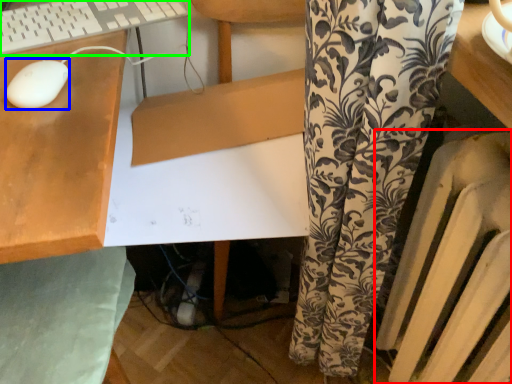
Question: Which object is positioned farthest from radiator (highlighted by a red box)? Select from mouse (highlighted by a blue box) and computer keyboard (highlighted by a green box).

Choices:
 (A) mouse
 (B) computer keyboard

Answer: (B)